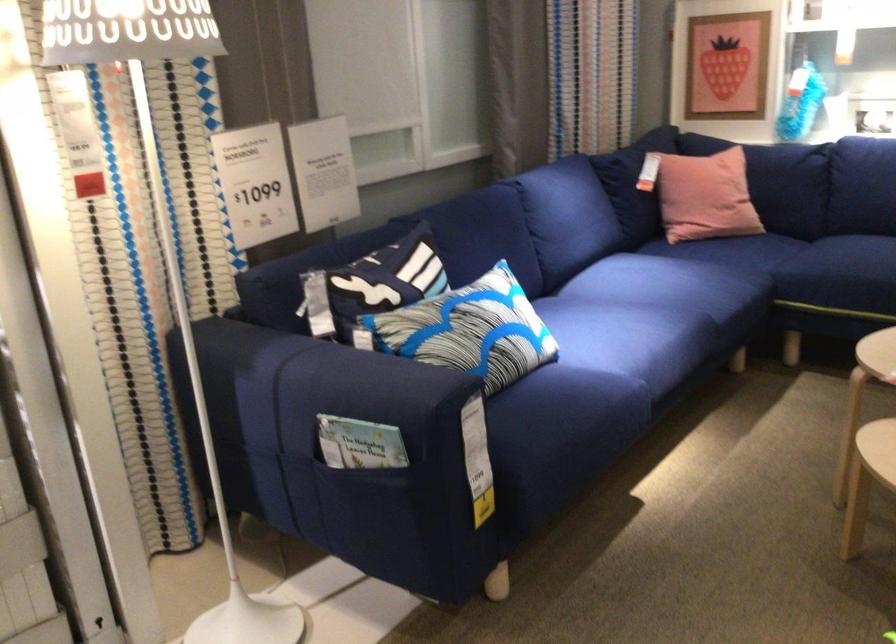
Find where to lift the small booklet. Please return your answer as a coordinate pair (x, y).

(359, 444)